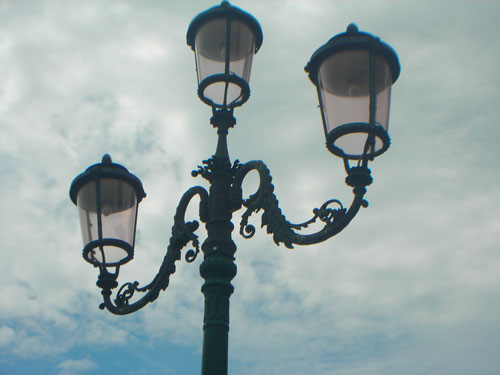
Image resolution: width=500 pixels, height=375 pixels. Identify the location of second glass light cover. (220, 80).